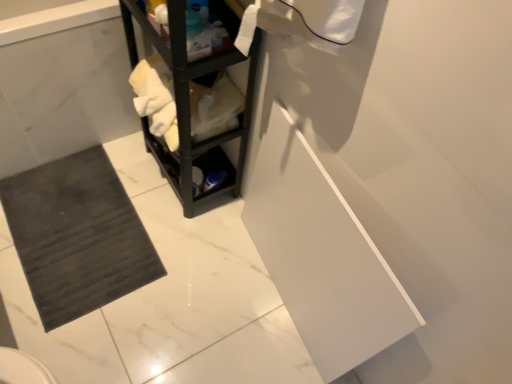
The height and width of the screenshot is (384, 512). Find the location of `vacant space that is in between black matte shelf at center and dark gray rubber bath mat at lower left`. vacant space that is in between black matte shelf at center and dark gray rubber bath mat at lower left is located at coordinates (158, 205).